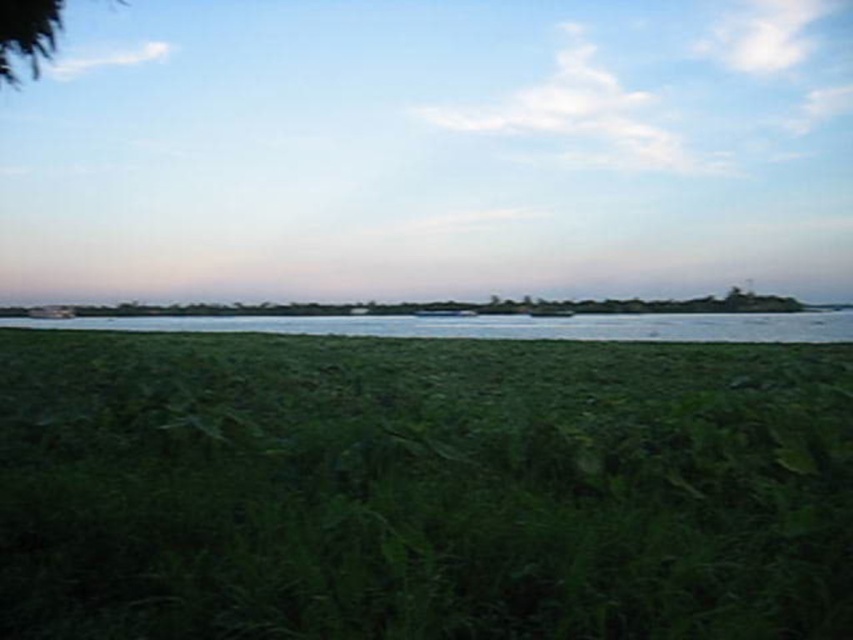
Question: Does clear water at center appear over green leafy tree at upper left?

Choices:
 (A) no
 (B) yes

Answer: (A)

Question: Can you confirm if green matte grass at center is positioned below green leafy tree at upper left?

Choices:
 (A) no
 (B) yes

Answer: (B)

Question: Considering the real-world distances, which object is farthest from the green leafy tree at upper left?

Choices:
 (A) green matte grass at center
 (B) clear water at center

Answer: (B)

Question: From the image, what is the correct spatial relationship of green matte grass at center in relation to green leafy tree at upper left?

Choices:
 (A) left
 (B) right

Answer: (B)

Question: Among these points, which one is nearest to the camera?

Choices:
 (A) (16, 317)
 (B) (22, 24)

Answer: (B)

Question: Which of the following is the farthest from the observer?

Choices:
 (A) green matte grass at center
 (B) green leafy tree at upper left
 (C) clear water at center

Answer: (C)